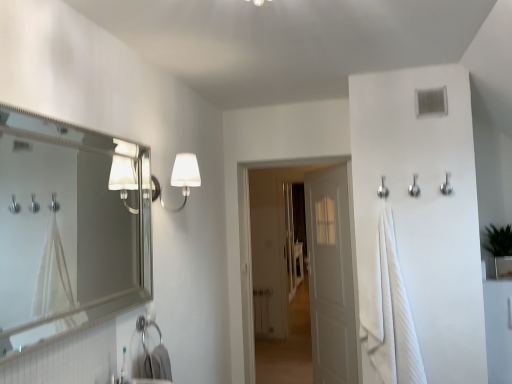
Question: Does silver/metallic mirror at left have a lesser height compared to white cotton bath towel at right?

Choices:
 (A) no
 (B) yes

Answer: (B)

Question: Is silver/metallic mirror at left outside of white cotton bath towel at right?

Choices:
 (A) no
 (B) yes

Answer: (B)

Question: Is the depth of silver/metallic mirror at left less than that of white cotton bath towel at right?

Choices:
 (A) no
 (B) yes

Answer: (B)

Question: From the image's perspective, does silver/metallic mirror at left appear higher than white cotton bath towel at right?

Choices:
 (A) no
 (B) yes

Answer: (B)

Question: Is white cotton bath towel at right surrounded by silver/metallic mirror at left?

Choices:
 (A) no
 (B) yes

Answer: (A)

Question: Is silver/metallic mirror at left further to camera compared to white cotton bath towel at right?

Choices:
 (A) yes
 (B) no

Answer: (B)

Question: Is white matte door at center, which is the second door from front to back, wider than silver metallic hook at upper right, which is the 2th shower in left-to-right order?

Choices:
 (A) yes
 (B) no

Answer: (A)

Question: Is white matte door at center, which is the second door from front to back, shorter than silver metallic hook at upper right, which ranks as the second shower in right-to-left order?

Choices:
 (A) no
 (B) yes

Answer: (A)

Question: Considering the relative positions of white matte door at center, positioned as the first door in back-to-front order, and silver metallic hook at upper right, which is the 2th shower in left-to-right order, in the image provided, is white matte door at center, positioned as the first door in back-to-front order, to the right of silver metallic hook at upper right, which is the 2th shower in left-to-right order, from the viewer's perspective?

Choices:
 (A) yes
 (B) no

Answer: (B)

Question: Would you say white matte door at center, which is the second door from front to back, contains silver metallic hook at upper right, which is the 2th shower in left-to-right order?

Choices:
 (A) yes
 (B) no

Answer: (B)

Question: Considering the relative sizes of white matte door at center, which is the second door from front to back, and silver metallic hook at upper right, which is the 2th shower in left-to-right order, in the image provided, is white matte door at center, which is the second door from front to back, taller than silver metallic hook at upper right, which is the 2th shower in left-to-right order,?

Choices:
 (A) yes
 (B) no

Answer: (A)

Question: From the image's perspective, is white matte door at center, positioned as the first door in back-to-front order, over silver metallic hook at upper right, which ranks as the second shower in right-to-left order?

Choices:
 (A) no
 (B) yes

Answer: (A)

Question: From the image's perspective, is white fabric lampshade at upper center over white plastic vent at upper right?

Choices:
 (A) no
 (B) yes

Answer: (A)